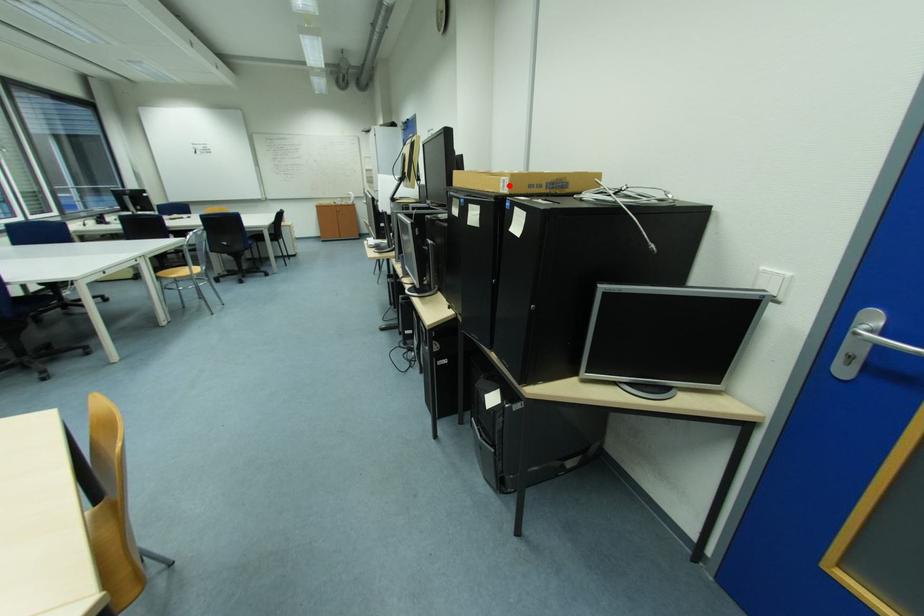
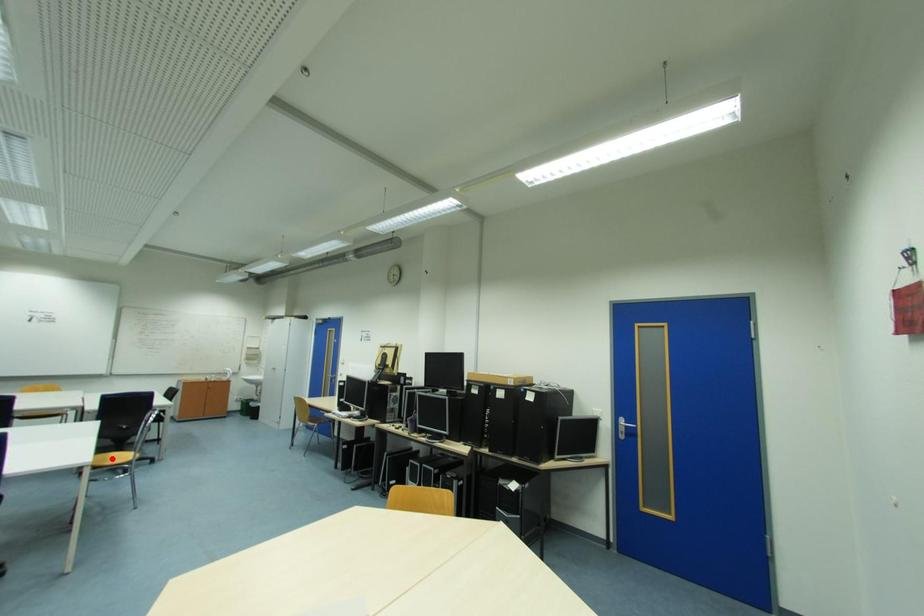
I am providing you with two images of the same scene from different viewpoints. A red point is marked on the first image and another point is marked on the second image. Do the highlighted points in image1 and image2 indicate the same real-world spot?

No